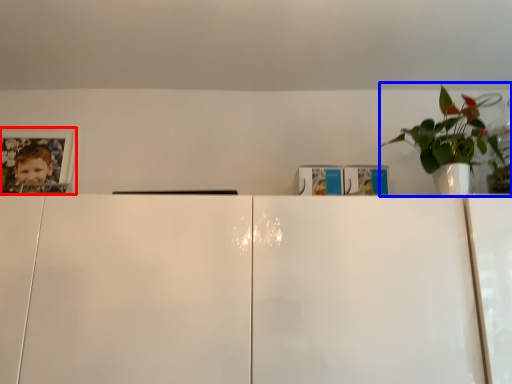
Question: Among these objects, which one is nearest to the camera, picture frame (highlighted by a red box) or houseplant (highlighted by a blue box)?

Choices:
 (A) picture frame
 (B) houseplant

Answer: (B)